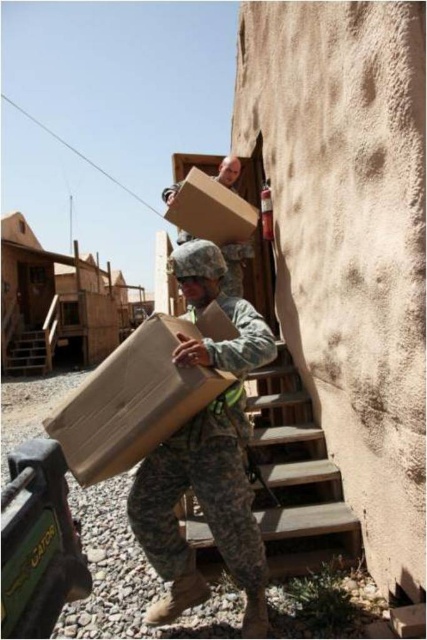
Does point (184, 403) come closer to viewer compared to point (312, 502)?

Yes, point (184, 403) is closer to viewer.

Is brown cardboard box at center to the left of concrete stairs at center from the viewer's perspective?

Indeed, brown cardboard box at center is positioned on the left side of concrete stairs at center.

This screenshot has width=427, height=640. Identify the location of brown cardboard box at center. (137, 396).

Find the location of a particular element. This screenshot has width=427, height=640. brown cardboard box at center is located at coordinates (137, 396).

Between brown cardboard box at center and camouflage uniform at center, which one has more height?

With more height is camouflage uniform at center.

Is brown cardboard box at center below camouflage uniform at center?

Correct, brown cardboard box at center is located below camouflage uniform at center.

Where is `brown cardboard box at center`? brown cardboard box at center is located at coordinates (137, 396).

Where is `brown cardboard box at center`? Image resolution: width=427 pixels, height=640 pixels. brown cardboard box at center is located at coordinates (137, 396).

Between point (292, 369) and point (173, 189), which one is positioned in front?

Point (292, 369) is in front.

Image resolution: width=427 pixels, height=640 pixels. In order to click on concrete stairs at center in this screenshot , I will do `click(297, 476)`.

Locate an element on the screen. concrete stairs at center is located at coordinates (297, 476).